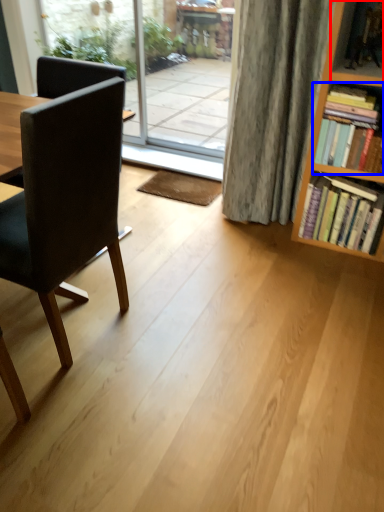
Question: Which object appears closest to the camera in this image, shelf (highlighted by a red box) or book (highlighted by a blue box)?

Choices:
 (A) shelf
 (B) book

Answer: (A)